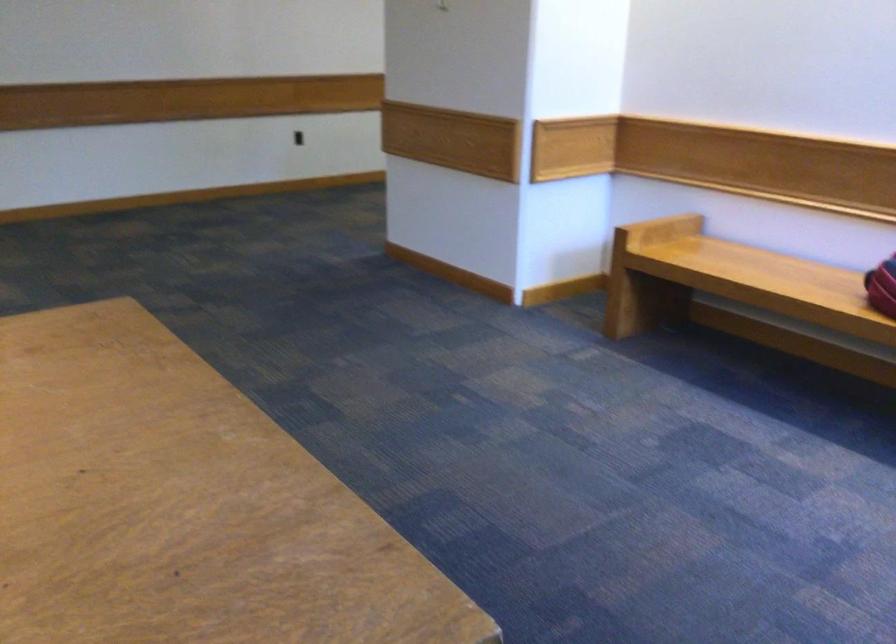
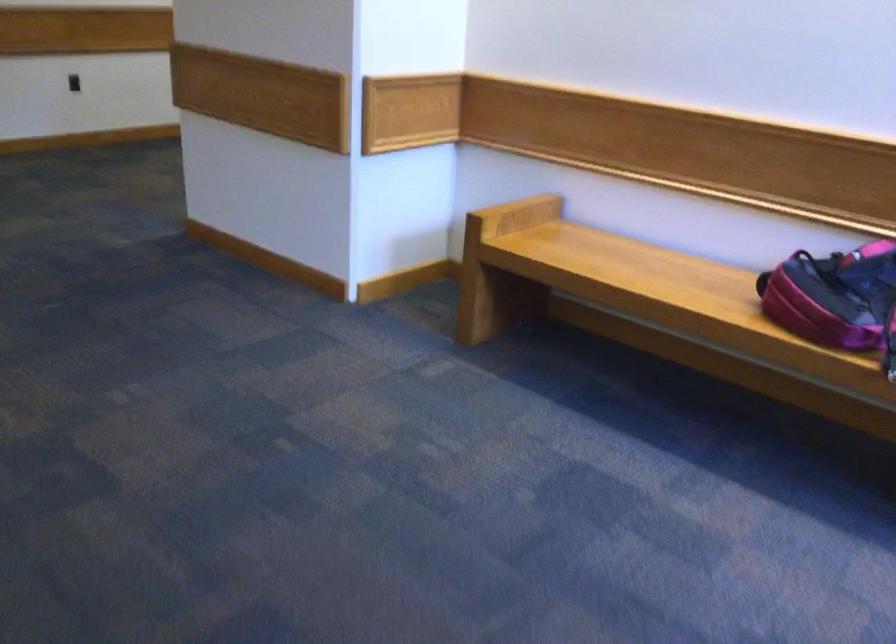
Question: How did the camera likely rotate?

Choices:
 (A) Left
 (B) Right
 (C) Up
 (D) Down

Answer: (B)